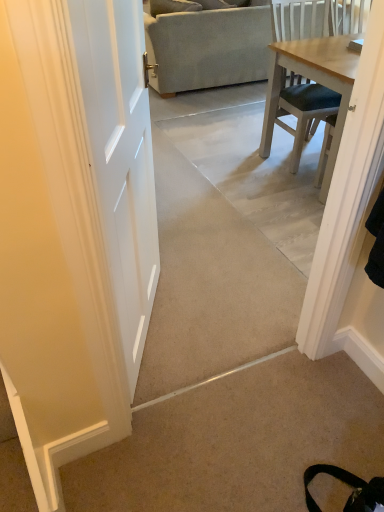
Locate an element on the screen. This screenshot has width=384, height=512. light gray fabric couch at upper center is located at coordinates (206, 44).

The image size is (384, 512). Describe the element at coordinates (206, 44) in the screenshot. I see `light gray fabric couch at upper center` at that location.

Where is `beige carpet at lower right`? beige carpet at lower right is located at coordinates (238, 441).

What do you see at coordinates (238, 441) in the screenshot?
I see `beige carpet at lower right` at bounding box center [238, 441].

The image size is (384, 512). Find the location of `light gray fabric couch at upper center`. light gray fabric couch at upper center is located at coordinates (206, 44).

Is beige carpet at lower right to the left or to the right of light gray fabric couch at upper center in the image?

From the image, it's evident that beige carpet at lower right is to the left of light gray fabric couch at upper center.

In the image, is beige carpet at lower right positioned in front of or behind light gray fabric couch at upper center?

In the image, beige carpet at lower right appears in front of light gray fabric couch at upper center.

Considering the positions of point (177, 456) and point (194, 27), is point (177, 456) closer or farther from the camera than point (194, 27)?

Clearly, point (177, 456) is closer to the camera than point (194, 27).

From the image's perspective, is beige carpet at lower right under light gray fabric couch at upper center?

Yes, from the image's perspective, beige carpet at lower right is below light gray fabric couch at upper center.

From a real-world perspective, which object rests below the other?

In real-world perspective, beige carpet at lower right is lower.

In terms of width, does beige carpet at lower right look wider or thinner when compared to light gray fabric couch at upper center?

beige carpet at lower right is thinner than light gray fabric couch at upper center.

Between beige carpet at lower right and light gray fabric couch at upper center, which one has less height?

beige carpet at lower right is shorter.

Between beige carpet at lower right and light gray fabric couch at upper center, which one has larger size?

light gray fabric couch at upper center is bigger.

From the picture: Is beige carpet at lower right not inside light gray fabric couch at upper center?

Absolutely, beige carpet at lower right is external to light gray fabric couch at upper center.

Does beige carpet at lower right touch light gray fabric couch at upper center?

No.

Could you tell me if beige carpet at lower right is facing light gray fabric couch at upper center?

No, beige carpet at lower right is not oriented towards light gray fabric couch at upper center.

Can you tell me how much beige carpet at lower right and light gray fabric couch at upper center differ in facing direction?

The angle between the facing direction of beige carpet at lower right and the facing direction of light gray fabric couch at upper center is 0.553 degrees.

Identify the location of concrete in front of the light gray fabric couch at upper center. (238, 441).

Is light gray fabric couch at upper center to the right of beige carpet at lower right from the viewer's perspective?

Yes, light gray fabric couch at upper center is to the right of beige carpet at lower right.

Is light gray fabric couch at upper center in front of beige carpet at lower right?

No, it is not.

Based on the photo, which is closer, (199, 8) or (306, 388)?

Point (199, 8) is farther from the camera than point (306, 388).

From the image's perspective, does light gray fabric couch at upper center appear lower than beige carpet at lower right?

Incorrect, from the image's perspective, light gray fabric couch at upper center is higher than beige carpet at lower right.

From a real-world perspective, is light gray fabric couch at upper center over beige carpet at lower right?

Yes, from a real-world perspective, light gray fabric couch at upper center is above beige carpet at lower right.

Considering the sizes of objects light gray fabric couch at upper center and beige carpet at lower right in the image provided, who is thinner, light gray fabric couch at upper center or beige carpet at lower right?

beige carpet at lower right is thinner.

Consider the image. In terms of height, does light gray fabric couch at upper center look taller or shorter compared to beige carpet at lower right?

light gray fabric couch at upper center is taller than beige carpet at lower right.

Between light gray fabric couch at upper center and beige carpet at lower right, which one has larger size?

With larger size is light gray fabric couch at upper center.

Is light gray fabric couch at upper center completely or partially outside of beige carpet at lower right?

Yes.

Are light gray fabric couch at upper center and beige carpet at lower right located far from each other?

Yes, light gray fabric couch at upper center is far from beige carpet at lower right.

Is light gray fabric couch at upper center looking in the opposite direction of beige carpet at lower right?

Correct, light gray fabric couch at upper center is looking away from beige carpet at lower right.

Identify the location of studio couch that is behind the beige carpet at lower right. (206, 44).

At what (x,y) coordinates should I click in order to perform the action: click on concrete in front of the light gray fabric couch at upper center. Please return your answer as a coordinate pair (x, y). Looking at the image, I should click on (238, 441).

Locate an element on the screen. studio couch behind the beige carpet at lower right is located at coordinates (206, 44).